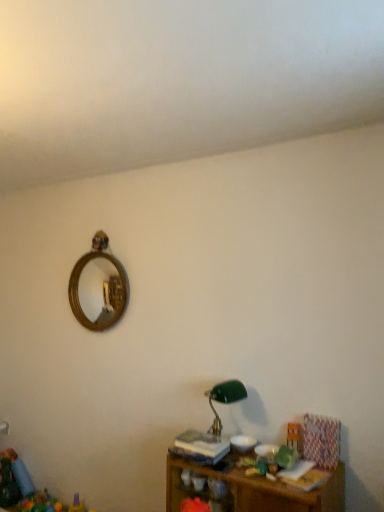
Question: From a real-world perspective, is wooden toy at lower right located higher than wooden shelf at lower right?

Choices:
 (A) yes
 (B) no

Answer: (A)

Question: Considering the relative sizes of wooden toy at lower right and wooden shelf at lower right in the image provided, is wooden toy at lower right smaller than wooden shelf at lower right?

Choices:
 (A) yes
 (B) no

Answer: (A)

Question: Does wooden toy at lower right turn towards wooden shelf at lower right?

Choices:
 (A) no
 (B) yes

Answer: (A)

Question: Can you confirm if wooden toy at lower right is positioned to the left of wooden shelf at lower right?

Choices:
 (A) yes
 (B) no

Answer: (B)

Question: Is wooden toy at lower right at the right side of wooden shelf at lower right?

Choices:
 (A) no
 (B) yes

Answer: (B)

Question: Is wooden toy at lower right looking in the opposite direction of wooden shelf at lower right?

Choices:
 (A) no
 (B) yes

Answer: (A)

Question: From a real-world perspective, is wooden toy at lower right positioned over green glass table lamp at lower center based on gravity?

Choices:
 (A) no
 (B) yes

Answer: (A)

Question: Does wooden toy at lower right have a lesser width compared to green glass table lamp at lower center?

Choices:
 (A) no
 (B) yes

Answer: (B)

Question: Does wooden toy at lower right appear on the right side of green glass table lamp at lower center?

Choices:
 (A) yes
 (B) no

Answer: (A)

Question: From the image's perspective, is wooden toy at lower right beneath green glass table lamp at lower center?

Choices:
 (A) no
 (B) yes

Answer: (B)

Question: Would you consider wooden toy at lower right to be distant from green glass table lamp at lower center?

Choices:
 (A) no
 (B) yes

Answer: (A)

Question: From the image's perspective, would you say wooden toy at lower right is positioned over green glass table lamp at lower center?

Choices:
 (A) yes
 (B) no

Answer: (B)

Question: Would you consider green glass table lamp at lower center to be distant from wooden shelf at lower right?

Choices:
 (A) no
 (B) yes

Answer: (A)